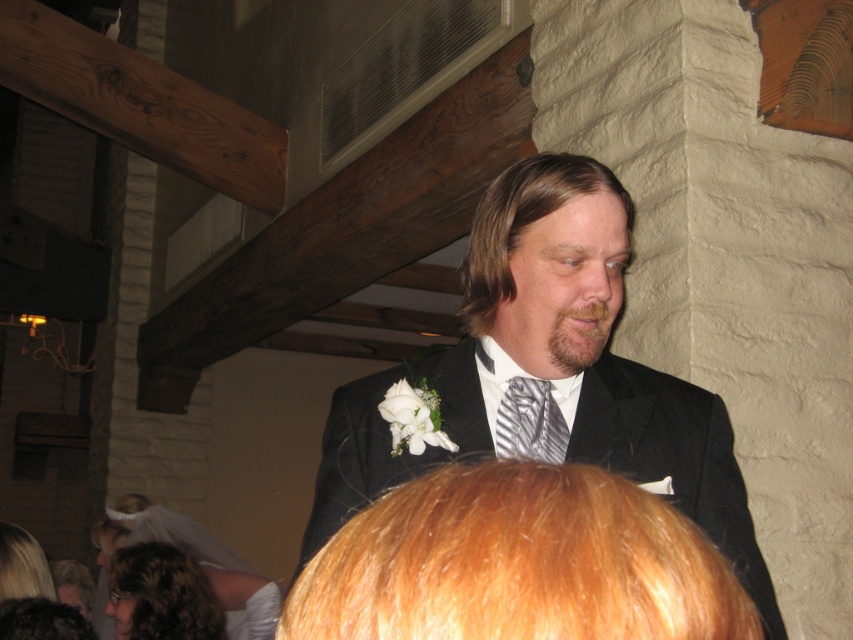
Does blonde silky hair at center appear on the right side of dark brown hair at lower left?

Correct, you'll find blonde silky hair at center to the right of dark brown hair at lower left.

Does blonde silky hair at center have a greater height compared to dark brown hair at lower left?

No.

Between point (625, 532) and point (59, 636), which one is positioned behind?

The point (59, 636) is more distant.

You are a GUI agent. You are given a task and a screenshot of the screen. Output one action in this format:
    pyautogui.click(x=<x>, y=<y>)
    Task: Click on the blonde silky hair at center
    
    Given the screenshot: What is the action you would take?
    pyautogui.click(x=518, y=563)

Can you confirm if blonde silky hair at center is thinner than blonde silky hair at lower left?

Indeed, blonde silky hair at center has a lesser width compared to blonde silky hair at lower left.

Which is more to the right, blonde silky hair at center or blonde silky hair at lower left?

blonde silky hair at center is more to the right.

Which is in front, point (520, 508) or point (42, 552)?

Positioned in front is point (520, 508).

The width and height of the screenshot is (853, 640). Find the location of `blonde silky hair at center`. blonde silky hair at center is located at coordinates (518, 563).

Can you confirm if blonde silky hair at center is taller than silver striped tie at center?

In fact, blonde silky hair at center may be shorter than silver striped tie at center.

Is blonde silky hair at center positioned behind silver striped tie at center?

No, blonde silky hair at center is in front of silver striped tie at center.

Find the location of a particular element. This screenshot has height=640, width=853. blonde silky hair at center is located at coordinates (518, 563).